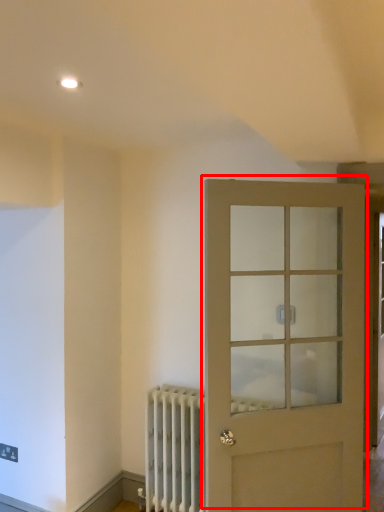
Question: Considering the relative positions of door (annotated by the red box) and radiator in the image provided, where is door (annotated by the red box) located with respect to the staircase?

Choices:
 (A) right
 (B) left

Answer: (A)